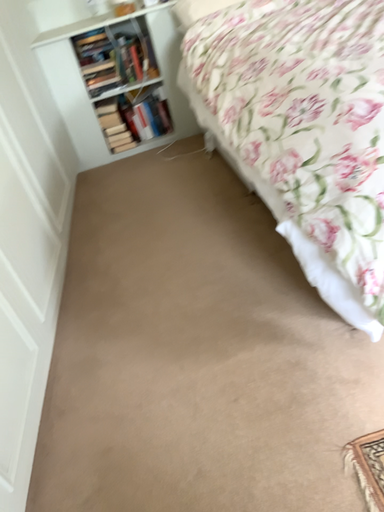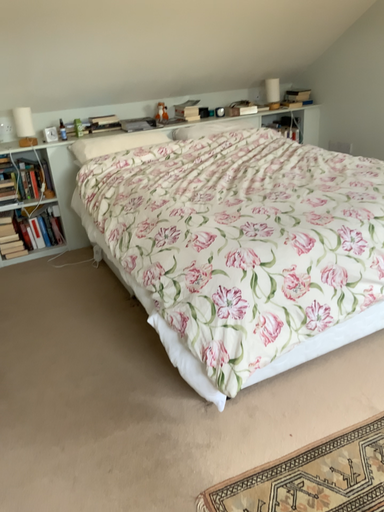
Question: Which way did the camera rotate in the video?

Choices:
 (A) rotated left
 (B) rotated right

Answer: (B)